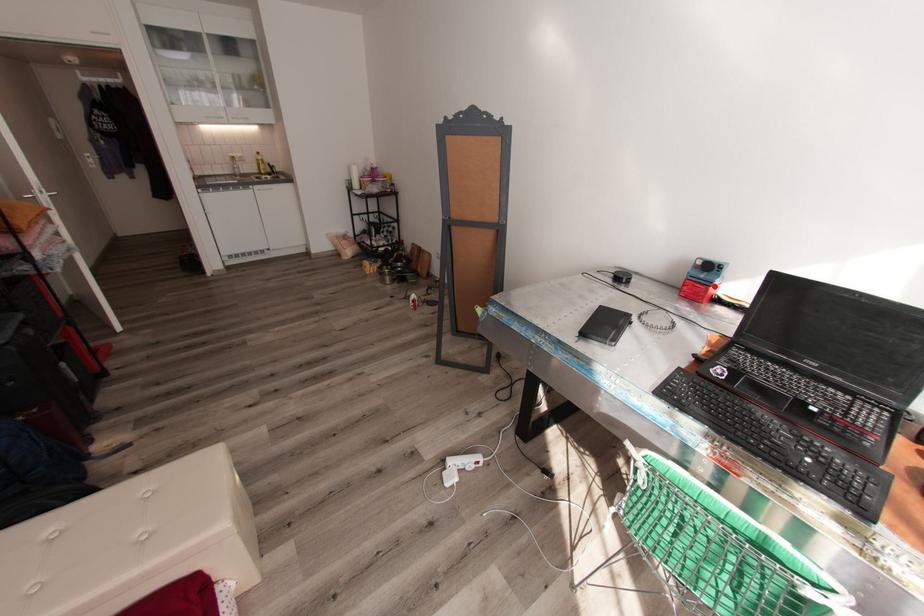
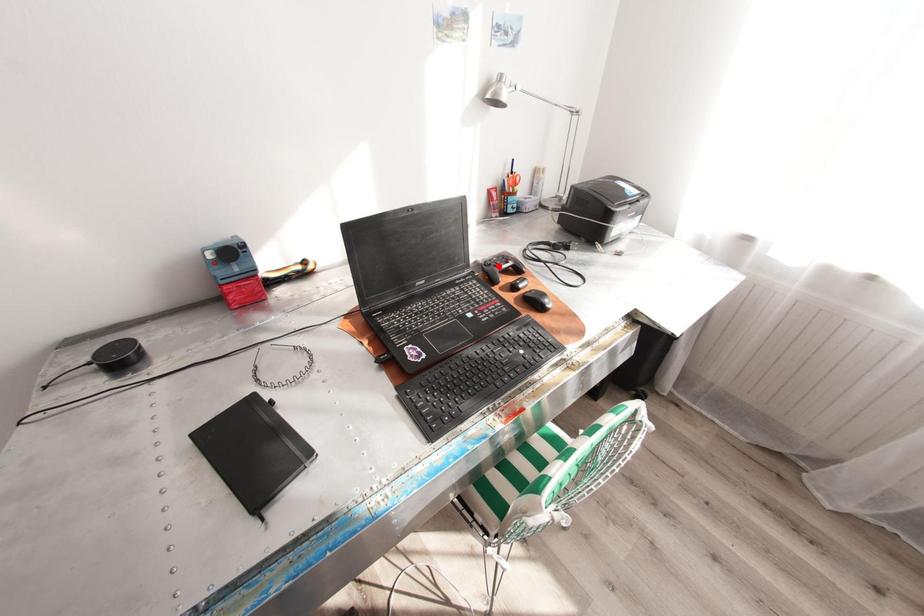
I am providing you with two images of the same scene from different viewpoints. A red point is marked on the first image and another point is marked on the second image. Do the highlighted points in image1 and image2 indicate the same real-world spot?

No